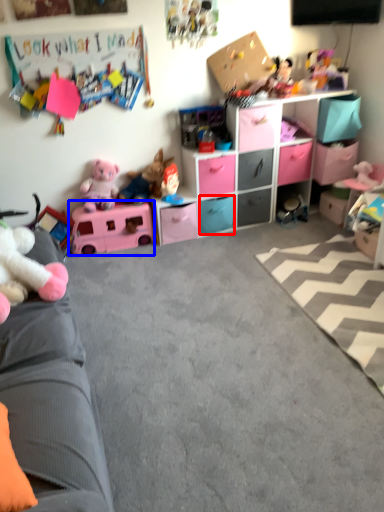
Question: Which of the following is the closest to the observer, drawer (highlighted by a red box) or toy (highlighted by a blue box)?

Choices:
 (A) drawer
 (B) toy

Answer: (B)